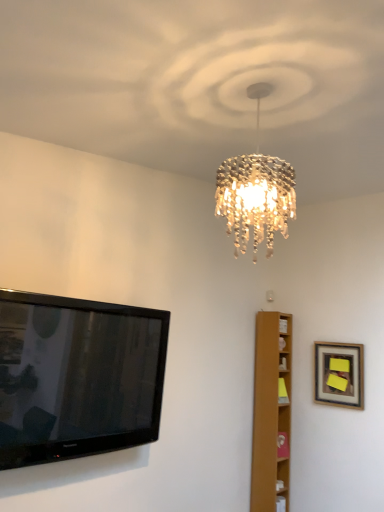
Question: Can you confirm if light brown wooden bookshelf at right is wider than wooden framed picture at upper right?

Choices:
 (A) no
 (B) yes

Answer: (B)

Question: Is light brown wooden bookshelf at right oriented away from wooden framed picture at upper right?

Choices:
 (A) no
 (B) yes

Answer: (A)

Question: Considering the relative positions of light brown wooden bookshelf at right and wooden framed picture at upper right in the image provided, is light brown wooden bookshelf at right to the right of wooden framed picture at upper right from the viewer's perspective?

Choices:
 (A) no
 (B) yes

Answer: (A)

Question: Considering the relative sizes of light brown wooden bookshelf at right and wooden framed picture at upper right in the image provided, is light brown wooden bookshelf at right shorter than wooden framed picture at upper right?

Choices:
 (A) yes
 (B) no

Answer: (B)

Question: Is light brown wooden bookshelf at right surrounding wooden framed picture at upper right?

Choices:
 (A) no
 (B) yes

Answer: (A)

Question: Would you consider light brown wooden bookshelf at right to be distant from wooden framed picture at upper right?

Choices:
 (A) no
 (B) yes

Answer: (A)

Question: From the image's perspective, would you say wooden framed picture at upper right is positioned over black glossy flat-screen tv at left?

Choices:
 (A) yes
 (B) no

Answer: (B)

Question: From a real-world perspective, is wooden framed picture at upper right positioned over black glossy flat-screen tv at left based on gravity?

Choices:
 (A) no
 (B) yes

Answer: (B)

Question: Is wooden framed picture at upper right not close to black glossy flat-screen tv at left?

Choices:
 (A) no
 (B) yes

Answer: (B)

Question: Does wooden framed picture at upper right have a lesser width compared to black glossy flat-screen tv at left?

Choices:
 (A) yes
 (B) no

Answer: (A)

Question: Is black glossy flat-screen tv at left located within wooden framed picture at upper right?

Choices:
 (A) yes
 (B) no

Answer: (B)

Question: Does wooden framed picture at upper right appear on the left side of black glossy flat-screen tv at left?

Choices:
 (A) no
 (B) yes

Answer: (A)

Question: Considering the relative sizes of wooden framed picture at upper right and light brown wooden bookshelf at right in the image provided, is wooden framed picture at upper right wider than light brown wooden bookshelf at right?

Choices:
 (A) no
 (B) yes

Answer: (A)